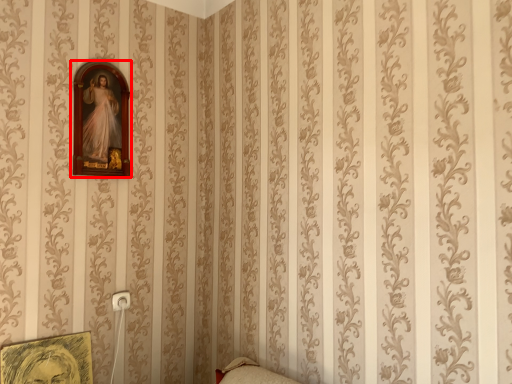
Question: From the image, what is the correct spatial relationship of picture frame (annotated by the red box) in relation to picture frame?

Choices:
 (A) right
 (B) left

Answer: (A)